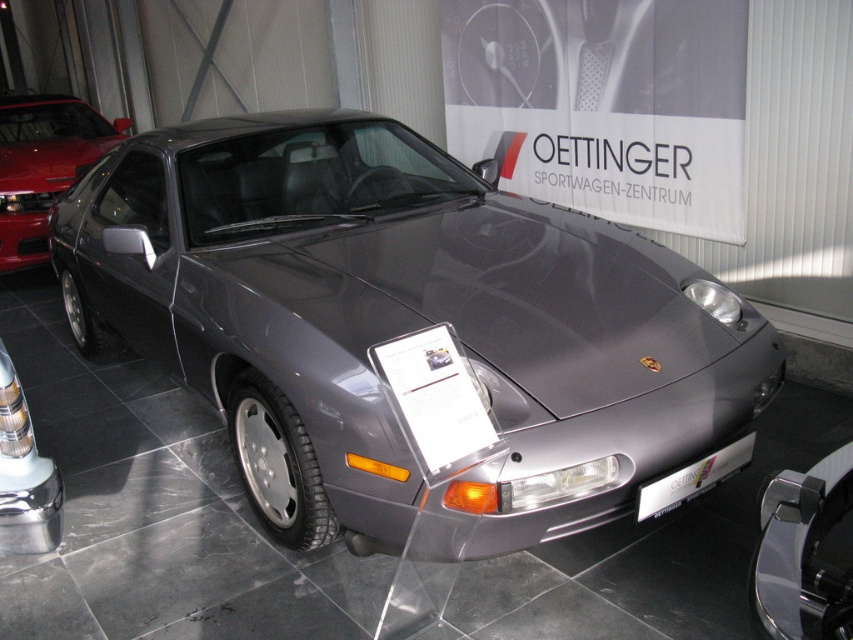
Question: Can you confirm if satin silver metallic car at center is positioned above silver metallic license plate at front?

Choices:
 (A) no
 (B) yes

Answer: (B)

Question: Which object is closer to the camera taking this photo?

Choices:
 (A) satin metallic car at center
 (B) silver metallic license plate at front

Answer: (A)

Question: Does satin metallic car at center appear over silver metallic license plate at front?

Choices:
 (A) yes
 (B) no

Answer: (A)

Question: Is satin metallic car at center behind silver metallic license plate at front?

Choices:
 (A) no
 (B) yes

Answer: (A)

Question: Which object is closer to the camera taking this photo?

Choices:
 (A) silver metallic license plate at front
 (B) satin silver metallic car at center
 (C) satin metallic car at center

Answer: (C)

Question: Among these objects, which one is nearest to the camera?

Choices:
 (A) satin silver metallic car at center
 (B) satin metallic car at center

Answer: (B)